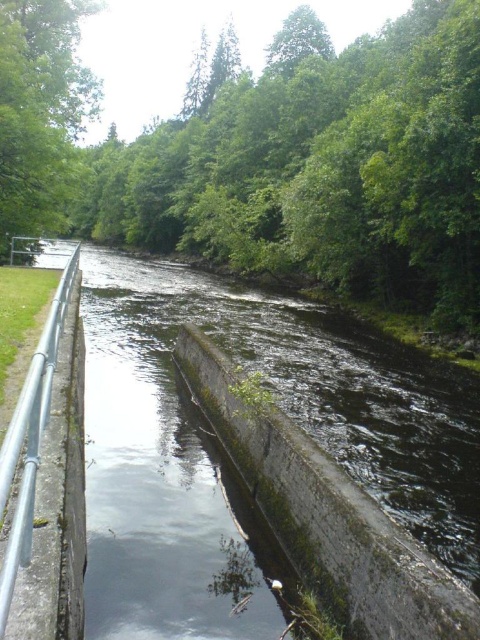
Question: Observing the image, what is the correct spatial positioning of dark green concrete at center in reference to green leafy tree at upper center?

Choices:
 (A) left
 (B) right

Answer: (B)

Question: Observing the image, what is the correct spatial positioning of green leafy tree at upper center in reference to silver metallic rail at left?

Choices:
 (A) above
 (B) below

Answer: (A)

Question: Is green leafy tree at upper center positioned in front of green leafy tree at upper left?

Choices:
 (A) yes
 (B) no

Answer: (A)

Question: Which of the following is the farthest from the observer?

Choices:
 (A) silver metallic rail at left
 (B) dark green concrete at center
 (C) green leafy tree at upper left

Answer: (C)

Question: Which of the following is the farthest from the observer?

Choices:
 (A) (38, 452)
 (B) (196, 188)

Answer: (B)

Question: Which point is closer to the camera?

Choices:
 (A) (392, 168)
 (B) (15, 147)

Answer: (B)